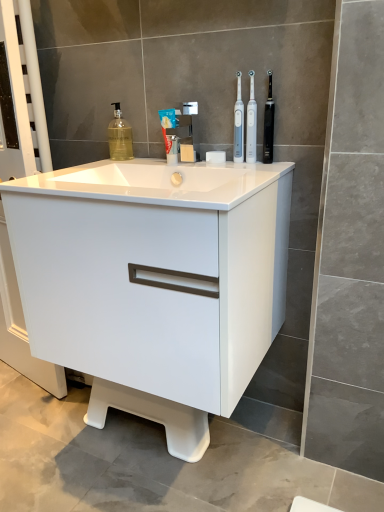
Question: Is blue matte toothpaste at center bigger or smaller than white plastic toothbrush at center, which appears as the 3th toothbrush when viewed from the right?

Choices:
 (A) small
 (B) big

Answer: (B)

Question: Considering their positions, is blue matte toothpaste at center located in front of or behind white plastic toothbrush at center, which appears as the 3th toothbrush when viewed from the right?

Choices:
 (A) behind
 (B) front

Answer: (A)

Question: Estimate the real-world distances between objects in this image. Which object is farther from the white glossy cabinet at center?

Choices:
 (A) blue matte toothpaste at center
 (B) black plastic toothbrush at upper right, the 1th toothbrush in the right-to-left sequence
 (C) white plastic toothbrush at upper center, acting as the 2th toothbrush starting from the right
 (D) gold metallic soap dispenser at upper left
 (E) white plastic toothbrush at center, which appears as the 3th toothbrush when viewed from the right

Answer: (D)

Question: Based on their relative distances, which object is farther from the black plastic toothbrush at upper right, which is the 3th toothbrush from left to right?

Choices:
 (A) blue matte toothpaste at center
 (B) white plastic toothbrush at upper center, acting as the 2th toothbrush starting from the right
 (C) gold metallic soap dispenser at upper left
 (D) white glossy sink at center
 (E) white glossy cabinet at center

Answer: (E)